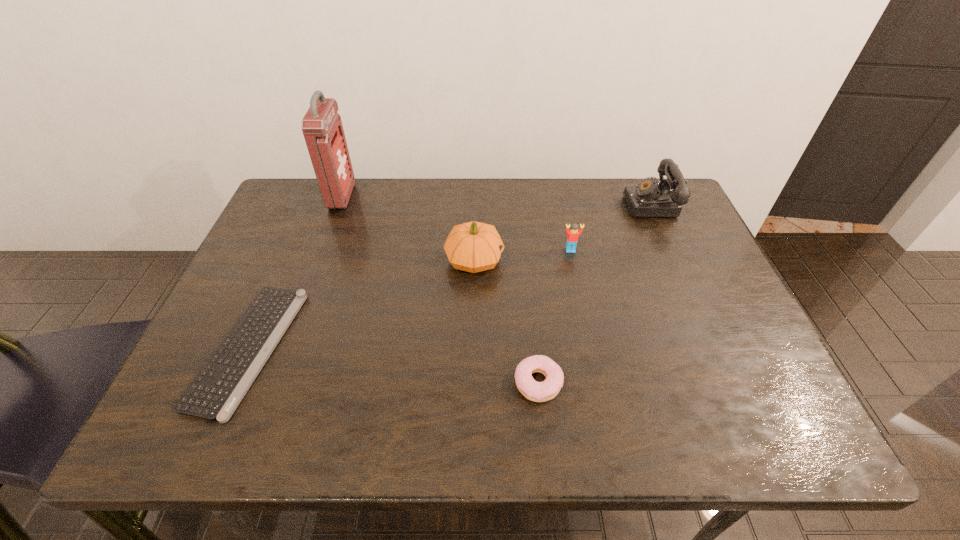
The width and height of the screenshot is (960, 540). I want to click on free point between the second shortest object and the rightmost object, so click(595, 293).

Identify the location of free space between the doughnut and the gourd. This screenshot has width=960, height=540. (506, 321).

I want to click on object identified as the second closest to the third object from right to left, so click(x=572, y=238).

Where is `object that is the fifth nearest to the computer keyboard`? The image size is (960, 540). object that is the fifth nearest to the computer keyboard is located at coordinates (649, 198).

At what (x,y) coordinates should I click in order to perform the action: click on vacant space that satisfies the following two spatial constraints: 1. on the back side of the doughnut; 2. on the side of the third object from left to right with the carved face. Please return your answer as a coordinate pair (x, y). Looking at the image, I should click on (525, 260).

Locate an element on the screen. The height and width of the screenshot is (540, 960). vacant space that satisfies the following two spatial constraints: 1. on the dial of the telephone; 2. on the face of the Lego is located at coordinates (674, 250).

Where is `vacant region that satisfies the following two spatial constraints: 1. on the side of the fourth object from right to left with the carved face; 2. on the left side of the doughnut`? The image size is (960, 540). vacant region that satisfies the following two spatial constraints: 1. on the side of the fourth object from right to left with the carved face; 2. on the left side of the doughnut is located at coordinates (472, 383).

Locate an element on the screen. This screenshot has width=960, height=540. vacant space that satisfies the following two spatial constraints: 1. on the side of the gourd with the carved face; 2. on the left side of the fifth tallest object is located at coordinates [472, 383].